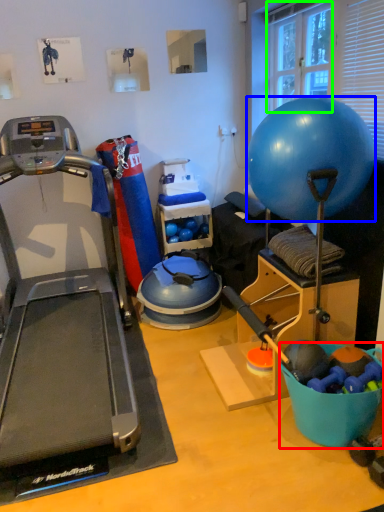
Question: Which object is the closest to the bowl (highlighted by a red box)? Choose among these: ball (highlighted by a blue box) or window screen (highlighted by a green box).

Choices:
 (A) ball
 (B) window screen

Answer: (A)